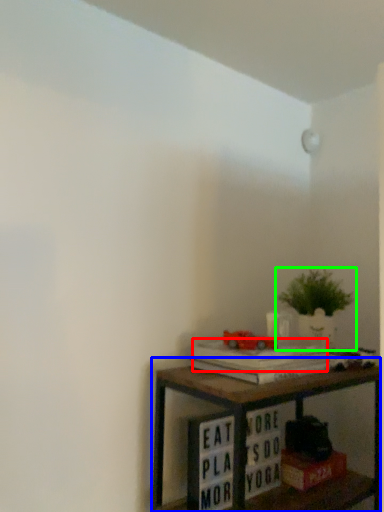
Question: Which is nearer to the paperback book (highlighted by a red box)? shelf (highlighted by a blue box) or houseplant (highlighted by a green box).

Choices:
 (A) shelf
 (B) houseplant

Answer: (A)